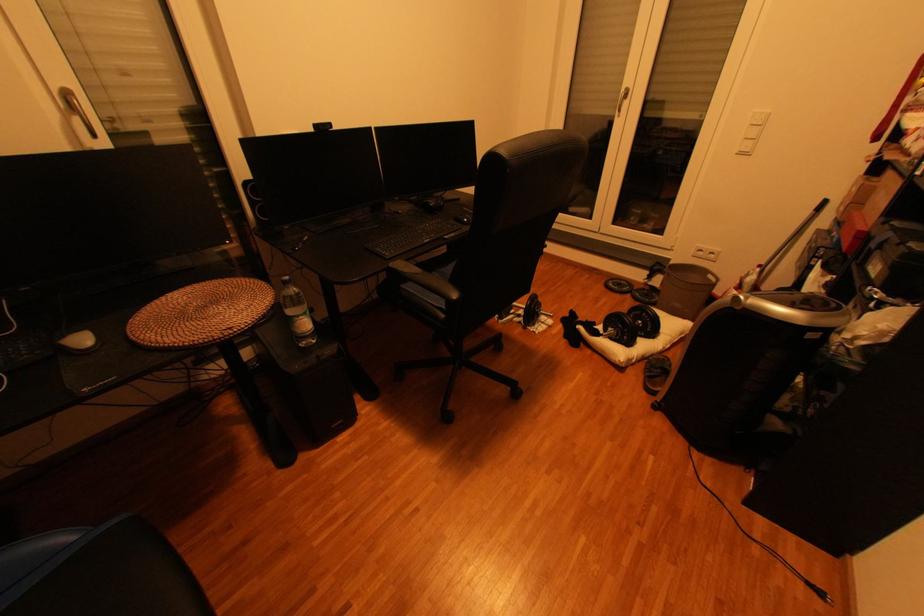
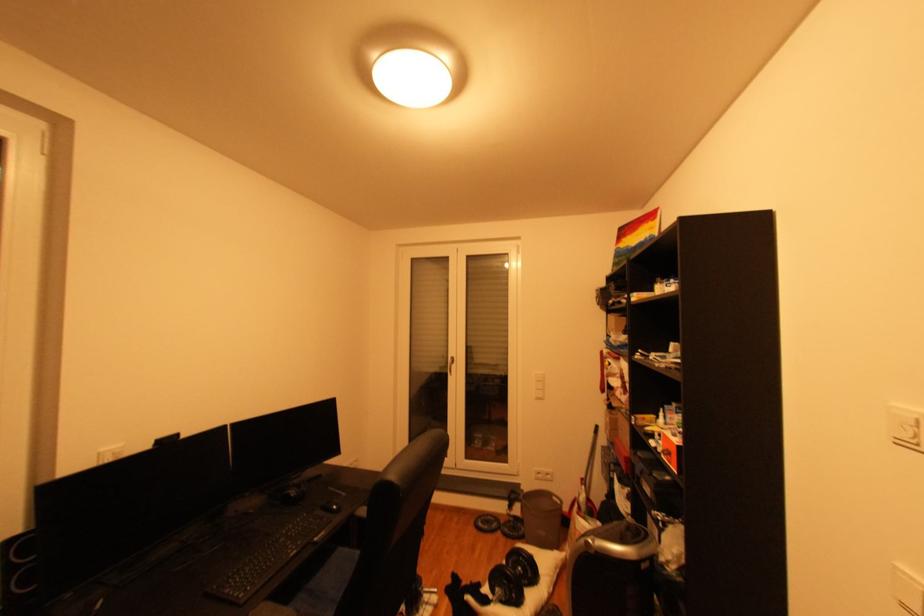
The first image is from the beginning of the video and the second image is from the end. How did the camera likely rotate when shooting the video?

The camera's rotation is toward right-up.